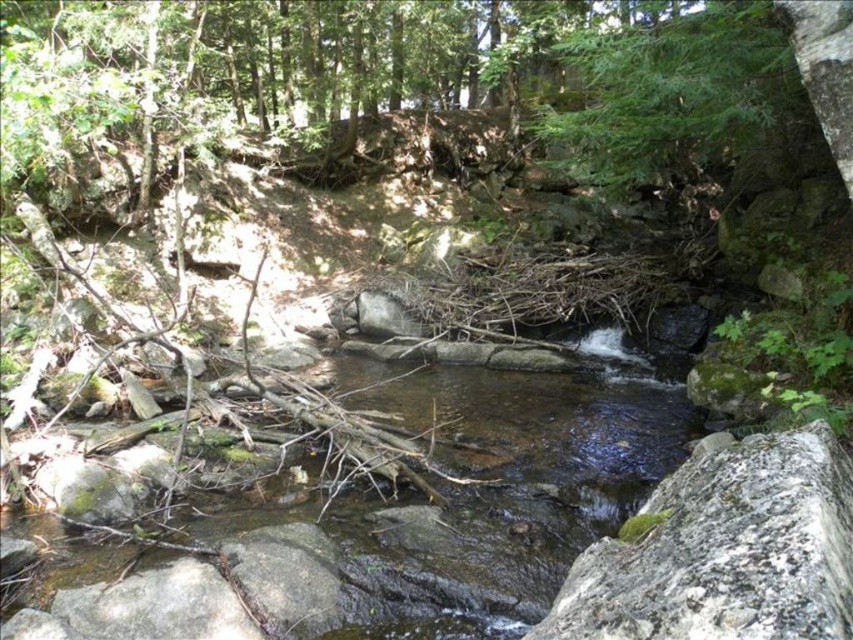
Can you confirm if green mossy rock at center is positioned to the left of green leafy tree at upper right?

Indeed, green mossy rock at center is positioned on the left side of green leafy tree at upper right.

Does green mossy rock at center come behind green leafy tree at upper right?

No, green mossy rock at center is in front of green leafy tree at upper right.

Which is behind, point (775, 483) or point (624, 144)?

The point (624, 144) is more distant.

Where is `green mossy rock at center`? This screenshot has width=853, height=640. green mossy rock at center is located at coordinates (726, 552).

Which of these two, clear water at center or green leafy tree at upper right, stands shorter?

Standing shorter between the two is clear water at center.

Is clear water at center to the right of green leafy tree at upper right from the viewer's perspective?

No, clear water at center is not to the right of green leafy tree at upper right.

Locate an element on the screen. Image resolution: width=853 pixels, height=640 pixels. clear water at center is located at coordinates (354, 515).

Which is in front, point (93, 500) or point (724, 602)?

Point (724, 602)

Does point (543, 435) come closer to viewer compared to point (724, 572)?

No, it is not.

Where is `clear water at center`? This screenshot has width=853, height=640. clear water at center is located at coordinates (354, 515).